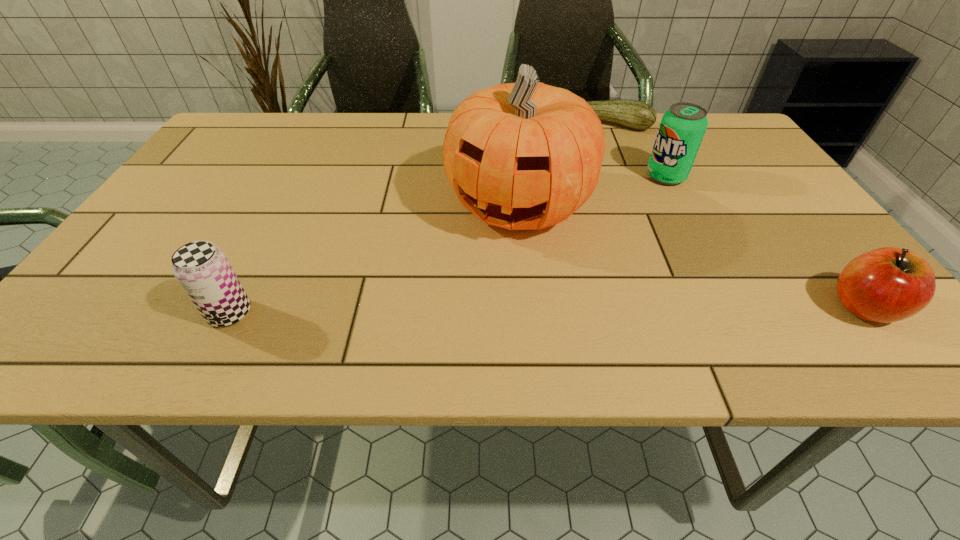
This screenshot has height=540, width=960. What are the coordinates of `vacant area that lies between the pop soda and the apple` in the screenshot? It's located at (x=764, y=241).

This screenshot has height=540, width=960. Identify the location of free spot between the zucchini and the rightmost object. (734, 216).

Find the location of a particular element. free space between the pumpkin and the leftmost object is located at coordinates (374, 259).

The image size is (960, 540). In order to click on free space between the fourth shortest object and the rightmost object in this screenshot , I will do point(764,241).

The image size is (960, 540). In order to click on vacant region between the fourth shortest object and the farthest object in this screenshot , I will do `click(636, 151)`.

This screenshot has height=540, width=960. I want to click on free space between the leftmost object and the apple, so [546, 310].

Find the location of a particular element. The image size is (960, 540). vacant space in between the zucchini and the rightmost object is located at coordinates (734, 216).

Find the location of a particular element. The image size is (960, 540). object that is the third closest one to the apple is located at coordinates (638, 115).

Locate which object ranks fourth in proximity to the rightmost object. Please provide its 2D coordinates. Your answer should be formatted as a tuple, i.e. [(x, y)], where the tuple contains the x and y coordinates of a point satisfying the conditions above.

[(202, 269)]

The height and width of the screenshot is (540, 960). I want to click on vacant space that satisfies the following two spatial constraints: 1. on the back side of the pumpkin; 2. on the left side of the farthest object, so click(x=511, y=125).